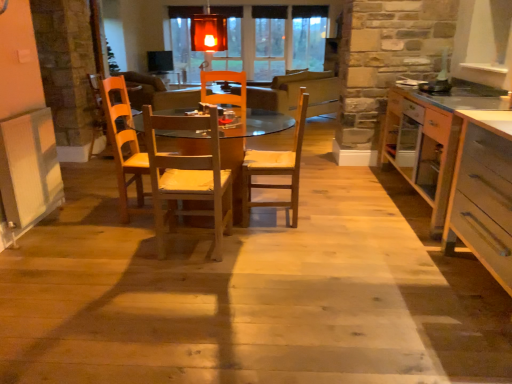
Question: Based on their sizes in the image, would you say wooden armchair at left is bigger or smaller than wooden chair at center, the 1th chair from the left?

Choices:
 (A) big
 (B) small

Answer: (A)

Question: From a real-world perspective, is wooden armchair at left physically located above or below wooden chair at center, the 1th chair from the left?

Choices:
 (A) below
 (B) above

Answer: (A)

Question: Based on their relative distances, which object is nearer to the light brown wooden chair at center, marked as the second chair in a left-to-right arrangement?

Choices:
 (A) wooden armchair at left
 (B) wooden table at center
 (C) wooden chair at center, the 1th chair from the left
 (D) light wood drawer at right
 (E) white laminate countertop at right

Answer: (C)

Question: Which is farther from the light brown wooden chair at center, placed as the first chair when sorted from right to left?

Choices:
 (A) white laminate countertop at right
 (B) wooden chair at center, the 1th chair from the left
 (C) light wood drawer at right
 (D) wooden table at center
 (E) wooden armchair at left

Answer: (E)